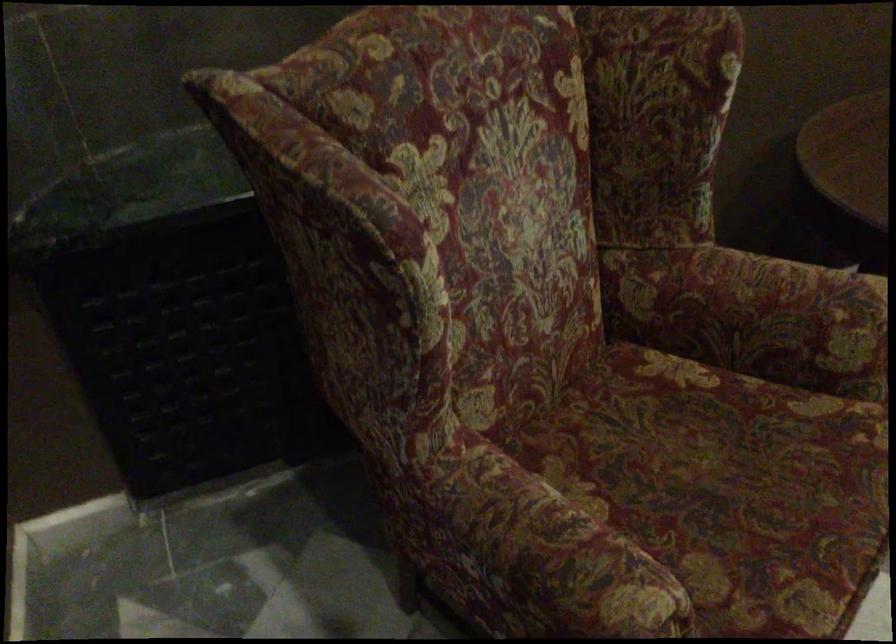
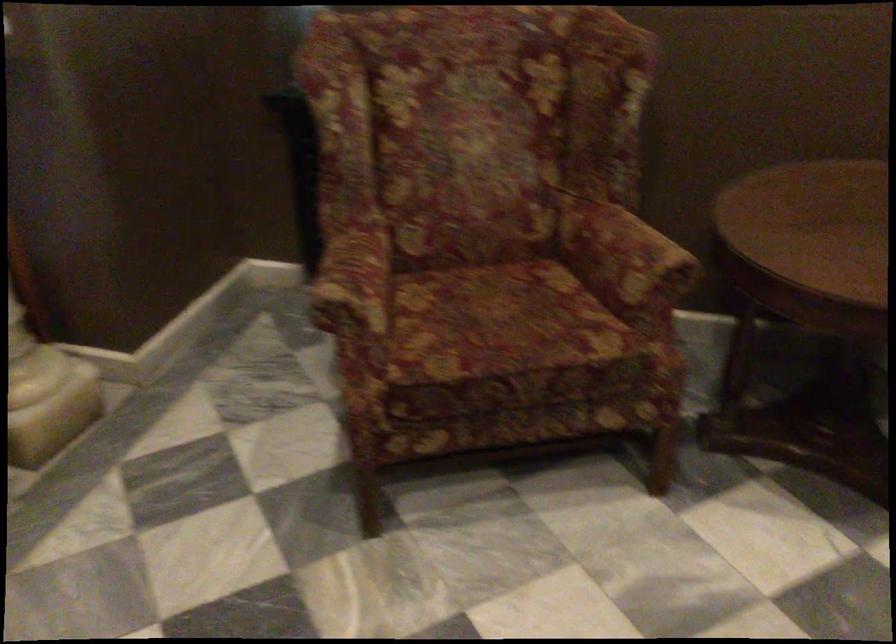
Find the pixel in the second image that matches (645,572) in the first image.

(355, 286)